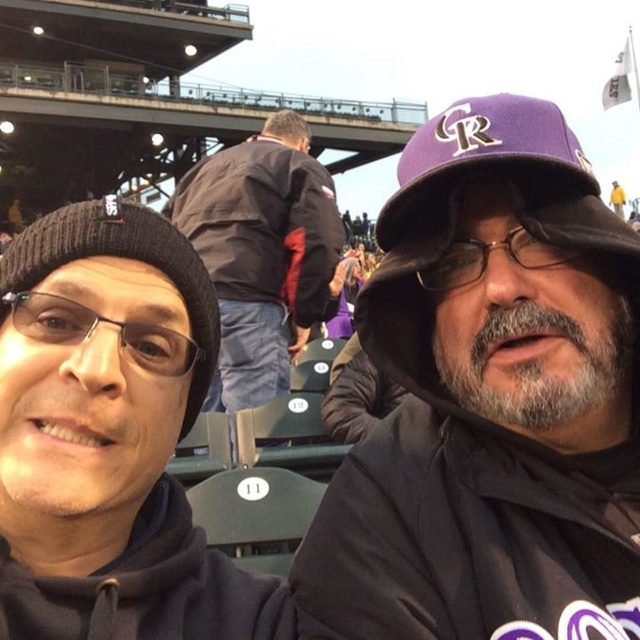
You are a photographer trying to capture a clear shot of both the purple matte baseball cap at center and the black knit cap at upper left. Considering their heights, which cap might block the view of the other when framing the shot?

The purple matte baseball cap at center is much taller than the black knit cap at upper left, so it might block the view of the black knit cap at upper left when framing the shot.

You are standing in the stadium and want to take a photo of both the point at coordinates point [83,416] and point [618,208]. Which point should you focus on first to ensure both are in focus?

You should focus on point [83,416] first because it is closer to the camera than point [618,208], ensuring both are within the depth of field.